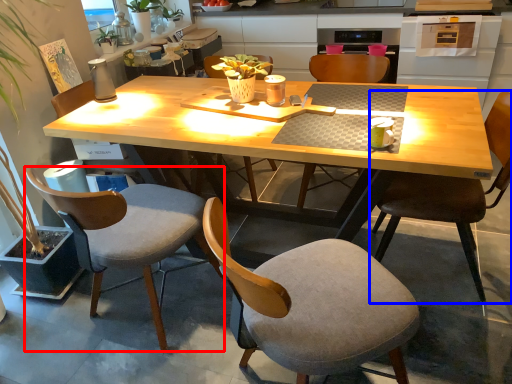
Question: Among these objects, which one is nearest to the camera, chair (highlighted by a red box) or chair (highlighted by a blue box)?

Choices:
 (A) chair
 (B) chair

Answer: (A)